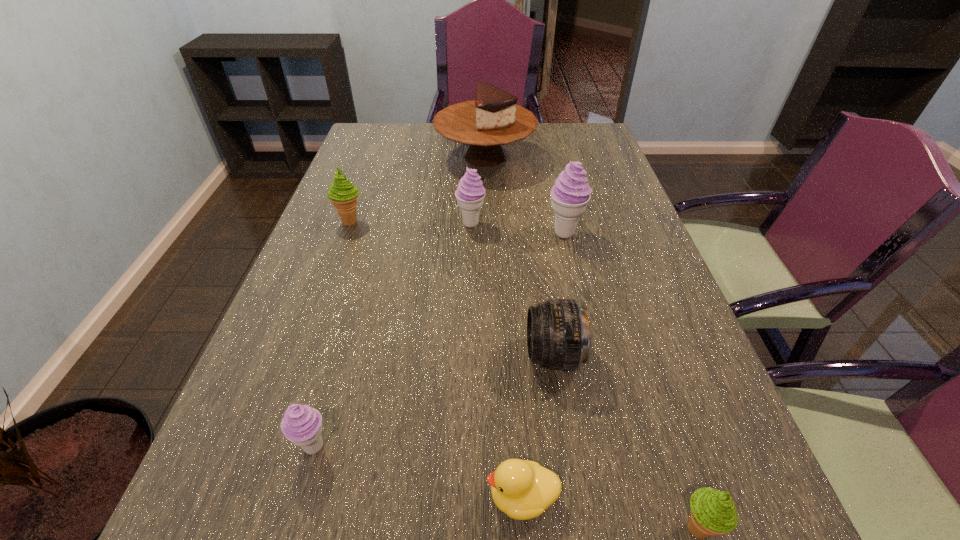
At what (x,y) coordinates should I click in order to perform the action: click on the smallest purple icecream. Please return your answer as a coordinate pair (x, y). Image resolution: width=960 pixels, height=540 pixels. Looking at the image, I should click on (302, 425).

The width and height of the screenshot is (960, 540). Find the location of `the shortest object`. the shortest object is located at coordinates (523, 489).

The width and height of the screenshot is (960, 540). I want to click on yellow duckling, so click(x=523, y=489).

The width and height of the screenshot is (960, 540). Identify the location of vacant space located 0.280m on the left of the farthest object. (350, 157).

Find the location of `free location located 0.360m on the front of the tallest icecream`. free location located 0.360m on the front of the tallest icecream is located at coordinates (594, 360).

In order to click on free location located 0.220m on the right of the second smallest purple icecream in this screenshot , I will do `click(566, 224)`.

Identify the location of vacant space located 0.270m on the right of the bigger green icecream. (465, 221).

This screenshot has width=960, height=540. Find the location of `vacant point located at the front element of the fourth nearest object`. vacant point located at the front element of the fourth nearest object is located at coordinates (325, 355).

You are a GUI agent. You are given a task and a screenshot of the screen. Output one action in this format:
    pyautogui.click(x=<x>, y=<y>)
    Task: Click on the blank space located 0.110m at the front element of the fourth nearest object
    Image resolution: width=960 pixels, height=540 pixels.
    Given the screenshot: What is the action you would take?
    pyautogui.click(x=471, y=355)

The height and width of the screenshot is (540, 960). I want to click on vacant space situated 0.280m at the front element of the fourth nearest object, so click(x=386, y=355).